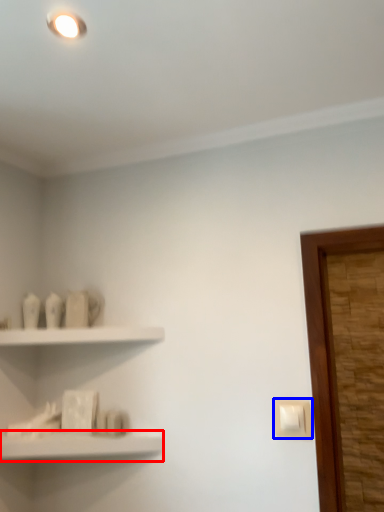
Question: Which of the following is the farthest to the observer, shelf (highlighted by a red box) or light switch (highlighted by a blue box)?

Choices:
 (A) shelf
 (B) light switch

Answer: (B)